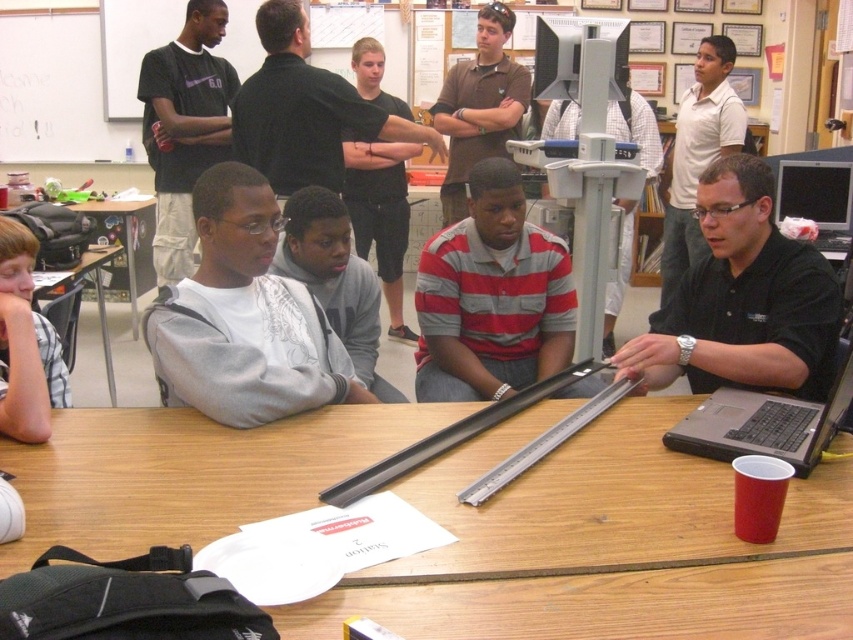
Looking at the classroom scene, there is a gray sweatshirt at center and a matte black laptop at right. From the perspective of someone sitting at the table, which object is positioned to the left?

The gray sweatshirt at center is to the left of the matte black laptop at right.

You are standing in the classroom and want to locate the striped cotton shirt at center. According to the coordinates given, where should you look to find it?

The striped cotton shirt at center is located at the 2D coordinates point (492, 296), so you should look towards the center of the image where those coordinates are marked.